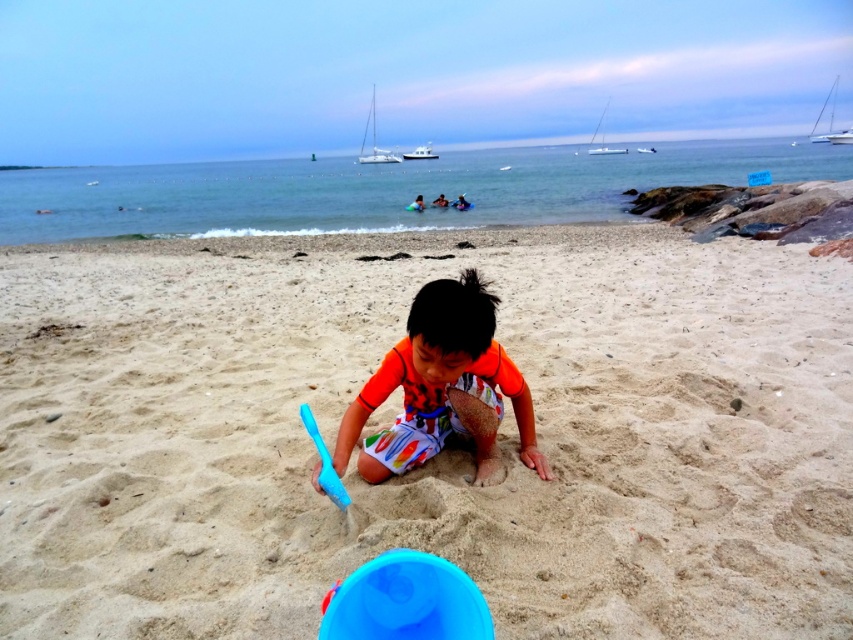
You are standing at the beach and see two points marked on the sand. One is at point (132, 550) and the other is at point (485, 429). If you walk towards the ocean, which point will you step on first?

Point (132, 550) is in front of point (485, 429), so you will step on point (132, 550) first when walking towards the ocean.

You are a photographer trying to capture a closeup of the smooth sand at center while also including the orange matte shirt at center in the frame. Based on their positions, will you need to adjust your camera focus to ensure both are in focus?

The smooth sand at center is closer to the viewer than the orange matte shirt at center, so you will need to adjust your camera focus to ensure both are in focus since they are at different distances.